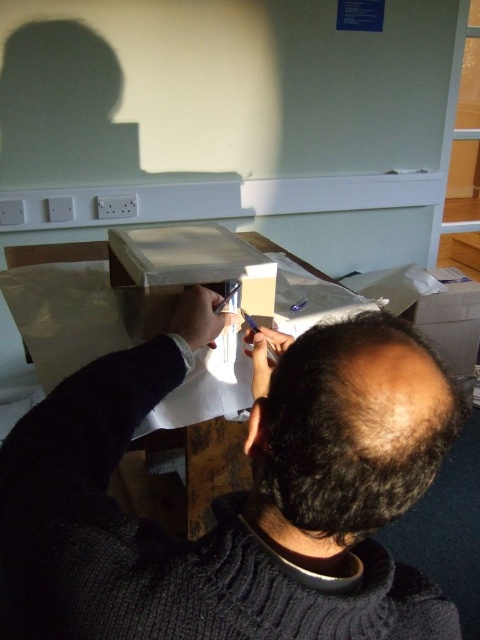
You are standing in front of the table where the person is writing. If you want to place a small object exactly at the coordinates mentioned for the dark gray sweater at center, where should you place it?

You should place the small object at the coordinates point (237,493) where the dark gray sweater at center is located.

You are organizing items on a table and need to place the dark gray sweater at center and the matte white box at center side by side. Based on their sizes, which item should be placed first to ensure they fit properly?

The dark gray sweater at center should be placed first because its width is greater than the matte white box at center, allowing enough space for both items to fit side by side.

You are standing in front of the table where the person is writing. Which object is located at the coordinates point (237, 493)?

The point (237, 493) corresponds to the dark gray sweater at center.